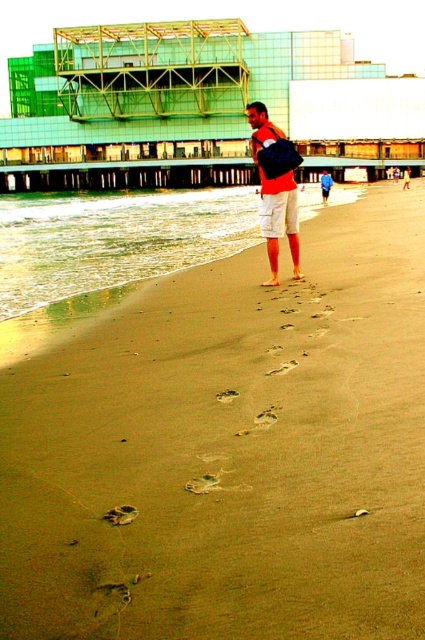
You are standing on the beach and see the brown sandy beach at center and the white cotton shorts at center. Which object is positioned to the right?

The brown sandy beach at center is positioned to the right of the white cotton shorts at center.

You are standing on the beach and see two points marked in the image. The first point is at coordinates point [413,324] and the second is at point [294,225]. Which point is closer to you?

Point [413,324] is closer to the viewer than point [294,225].

You are a photographer planning to capture a sunset shot at this beach. You notice a person wearing a matte orange shirt at center and matte orange shorts at center. Which piece of clothing will appear closer to the horizon line in your photo?

The matte orange shirt at center is located above the matte orange shorts at center, so the shirt will be closer to the horizon line in the photo.